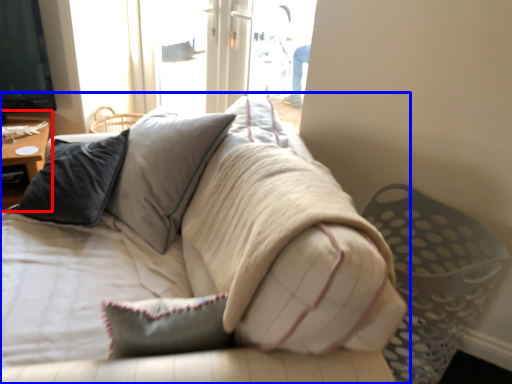
Question: Among these objects, which one is farthest to the camera, table (highlighted by a red box) or studio couch (highlighted by a blue box)?

Choices:
 (A) table
 (B) studio couch

Answer: (A)